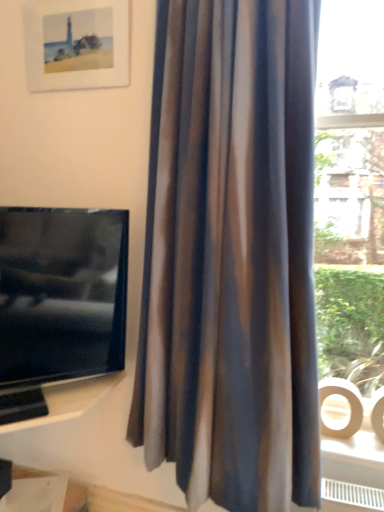
Question: Considering the relative positions of white glossy shelf at lower left and silky brown curtain at center in the image provided, is white glossy shelf at lower left to the left or to the right of silky brown curtain at center?

Choices:
 (A) right
 (B) left

Answer: (B)

Question: Looking at their shapes, would you say white glossy shelf at lower left is wider or thinner than silky brown curtain at center?

Choices:
 (A) thin
 (B) wide

Answer: (A)

Question: Which object is the farthest from the silky brown curtain at center?

Choices:
 (A) white glossy shelf at lower left
 (B) matte paper picture frame at upper left
 (C) matte black tv at left

Answer: (B)

Question: Estimate the real-world distances between objects in this image. Which object is closer to the matte black tv at left?

Choices:
 (A) silky brown curtain at center
 (B) matte paper picture frame at upper left
 (C) white glossy shelf at lower left

Answer: (C)